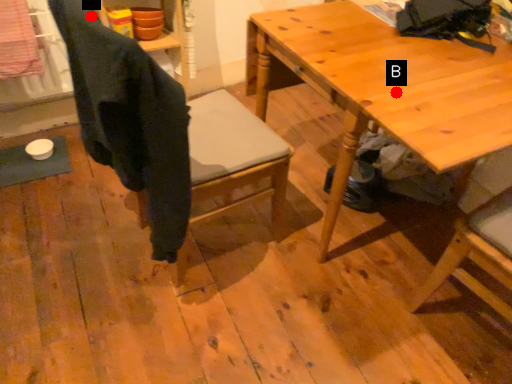
Question: Two points are circled on the image, labeled by A and B beside each circle. Among these points, which one is nearest to the camera?

Choices:
 (A) A is closer
 (B) B is closer

Answer: (A)